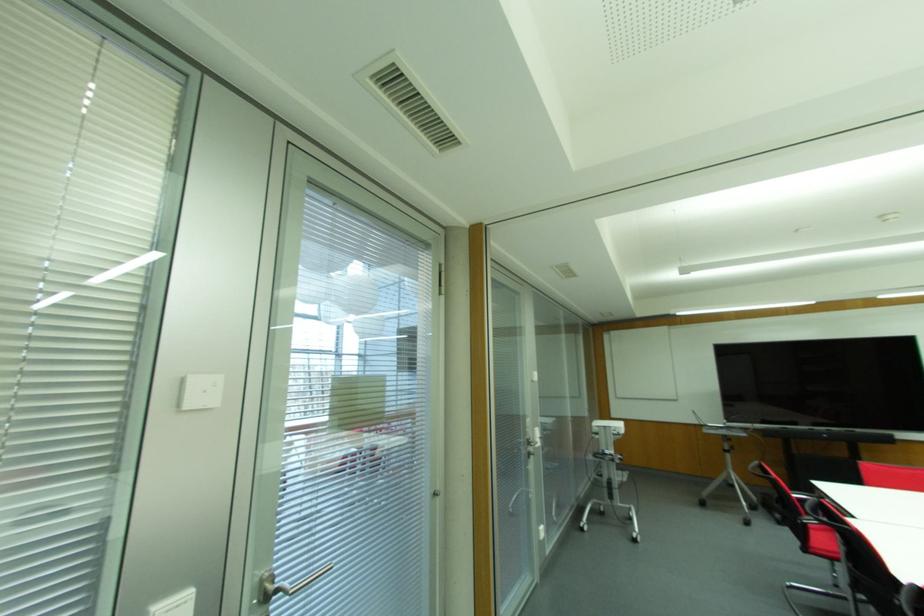
Identify the location of silver laptop. The width and height of the screenshot is (924, 616). (706, 424).